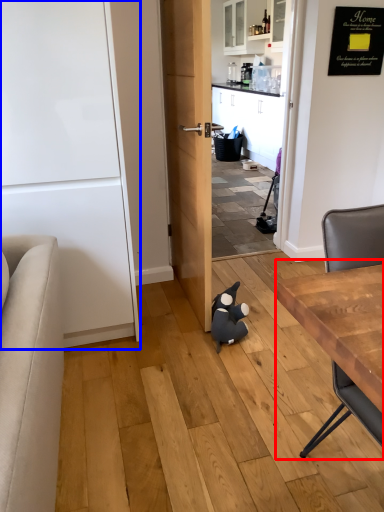
Question: Which point is further to the camera, table (highlighted by a red box) or door (highlighted by a blue box)?

Choices:
 (A) table
 (B) door

Answer: (B)